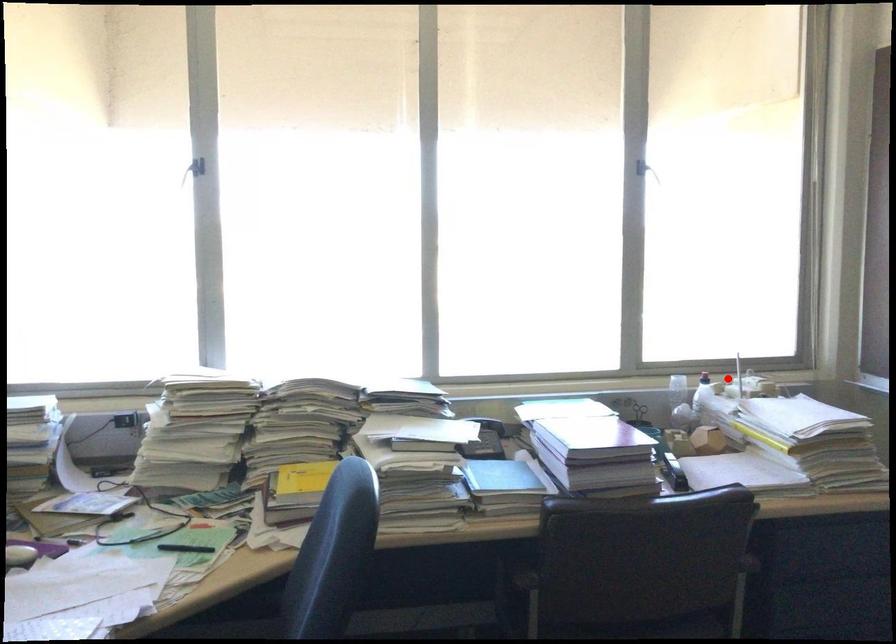
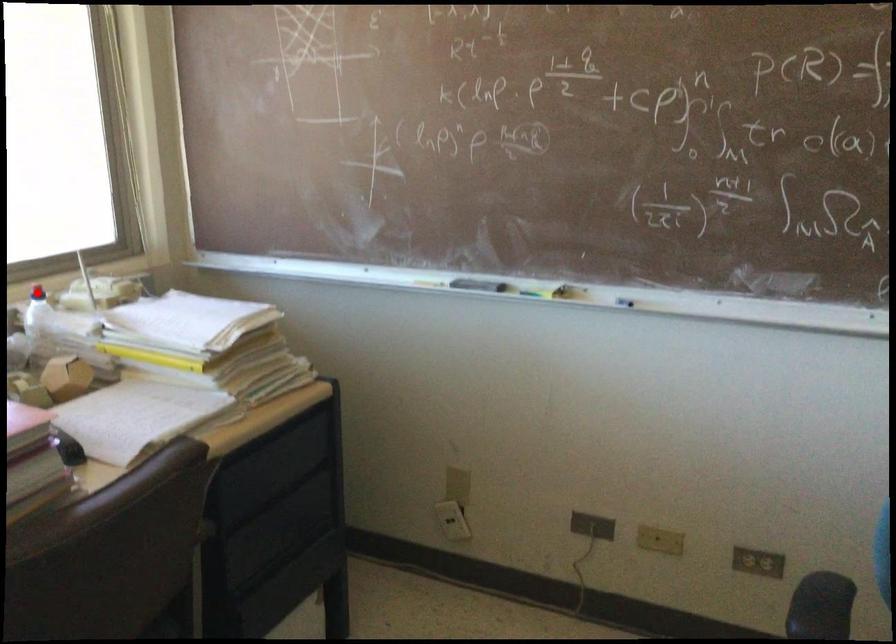
I am providing you with two images of the same scene from different viewpoints. A red point is marked on the first image and another point is marked on the second image. Does the point marked in image1 correspond to the same location as the one in image2?

Yes